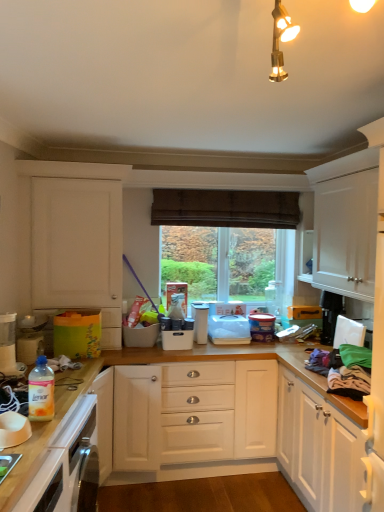
Find the location of a particular element. The image size is (384, 512). vacant point above white plastic container at center, placed as the fourth appliance when sorted from right to left (from a real-world perspective) is located at coordinates (182, 326).